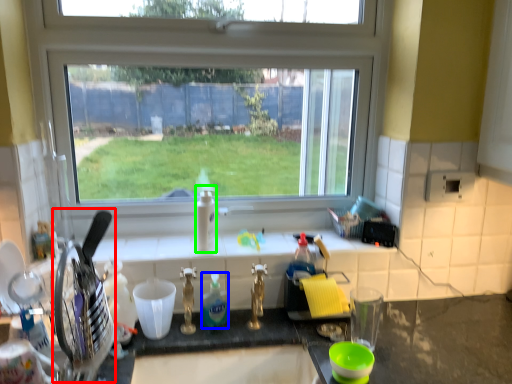
Question: Which is nearer to the appliance (highlighted by a red box)? bottle (highlighted by a blue box) or bottle (highlighted by a green box).

Choices:
 (A) bottle
 (B) bottle

Answer: (A)